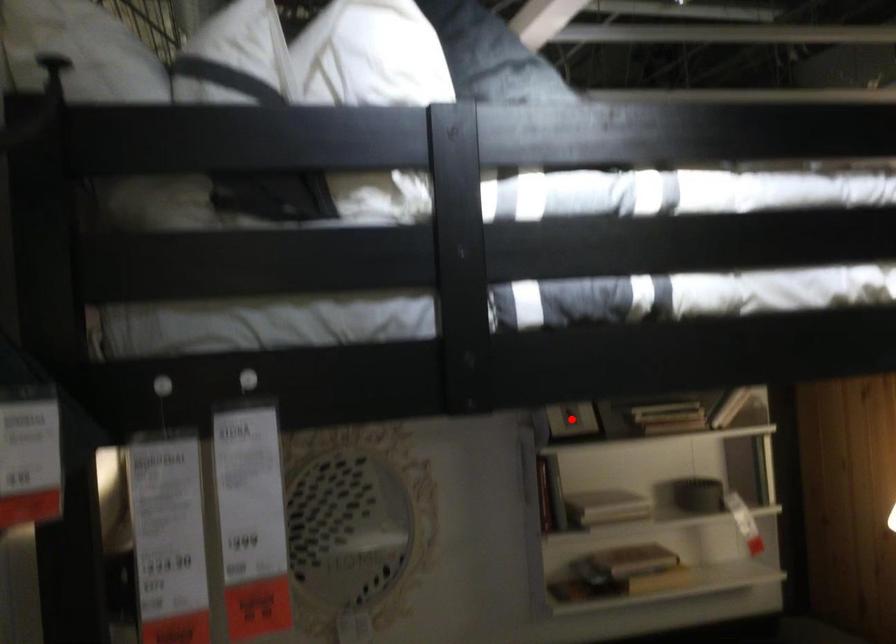
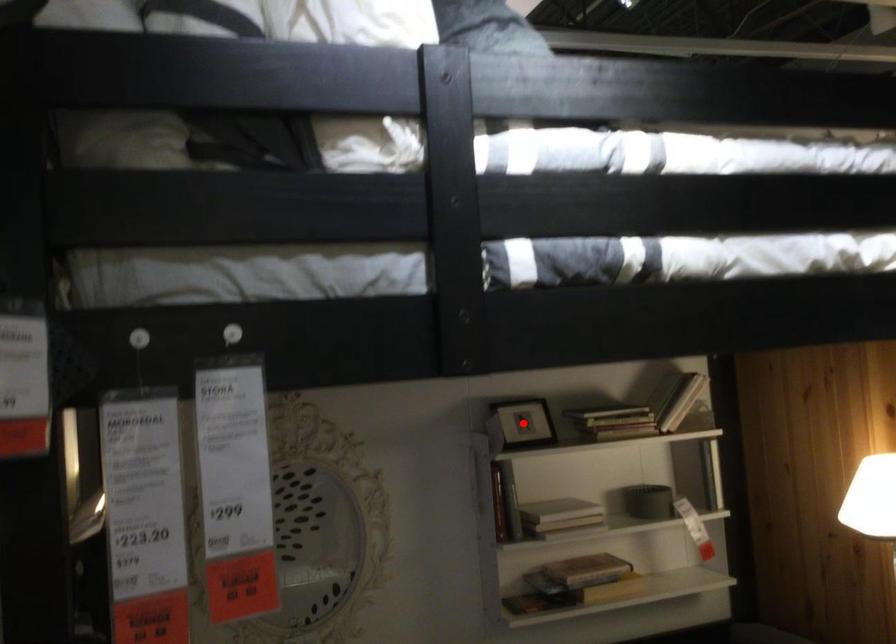
I am providing you with two images of the same scene from different viewpoints. A red point is marked on the first image and another point is marked on the second image. Are the points marked in image1 and image2 representing the same 3D position?

Yes